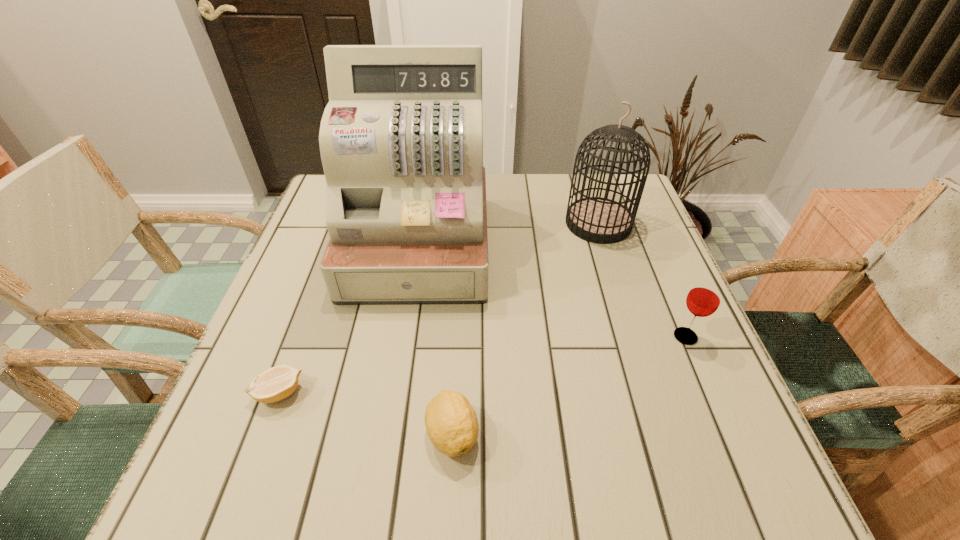
The image size is (960, 540). I want to click on the tallest object, so click(x=401, y=139).

Locate an element on the screen. the second tallest object is located at coordinates (599, 220).

Where is `the third shortest object`? the third shortest object is located at coordinates coord(704,298).

I want to click on the third nearest object, so click(x=704, y=298).

The width and height of the screenshot is (960, 540). Find the location of `the right lemon`. the right lemon is located at coordinates (451, 423).

Identify the location of the second shortest object. (451, 423).

Locate an element on the screen. the shortest object is located at coordinates 277,383.

Identify the location of the shorter lemon. (277, 383).

At what (x,y) coordinates should I click in order to perform the action: click on vacant region located on the operating side of the tallest object. Please return your answer as a coordinate pair (x, y). Looking at the image, I should click on (396, 384).

Identify the location of vacant space located 0.370m on the left of the second tallest object. The image size is (960, 540). (427, 224).